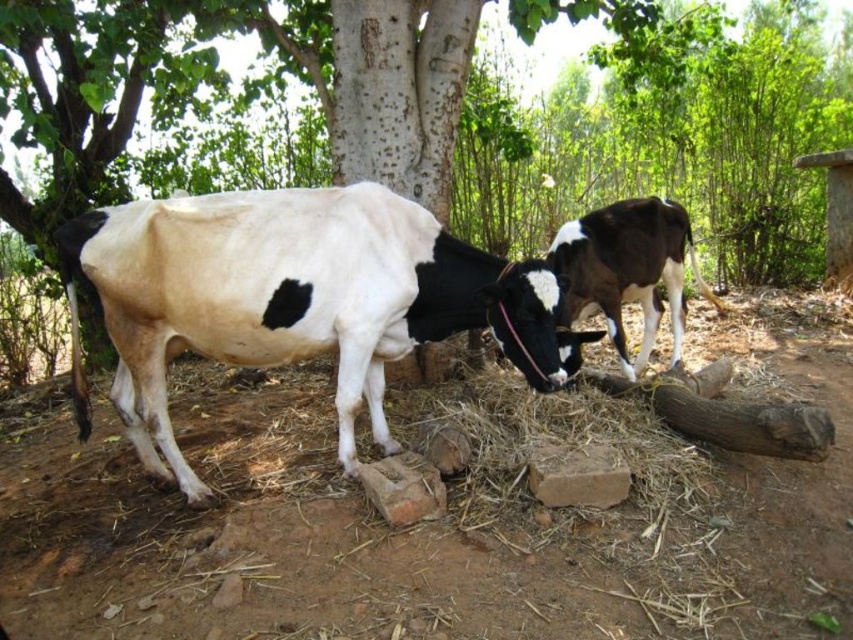
You are standing at the point marked by the coordinates point [326,298] in the image. You want to walk directly towards the viewer. How far will you have to walk to reach the viewer?

The distance between point [326,298] and the viewer is 3.15 meters, so you will have to walk 3.15 meters to reach the viewer.

Based on the photo, you are a farmer checking the grazing area. You need to know which object is wider between the brown soil at center and the rough bark tree at center. Which one is wider?

The brown soil at center is wider than the rough bark tree at center according to the description.

You are a farmer who wants to check the distance between the brown soil at center and the black and white cow at right. Can you confirm if the distance is more than 1.3 meters?

The brown soil at center and black and white cow at right are 1.40 meters apart, so the distance is more than 1.3 meters.